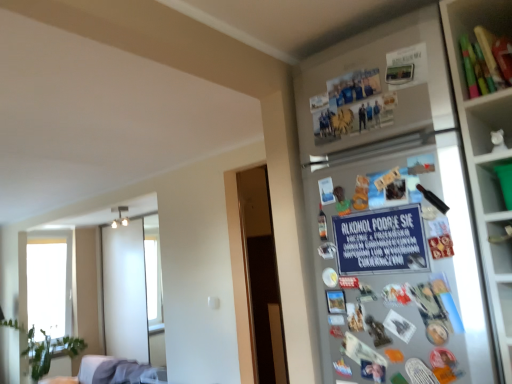
What is the approximate height of transparent glass window at left?

transparent glass window at left is 5.44 feet in height.

Locate an element on the screen. This screenshot has height=384, width=512. transparent glass window at left is located at coordinates (47, 286).

At what (x,y) coordinates should I click in order to perform the action: click on blue paper sign at upper right. Please return your answer as a coordinate pair (x, y). The height and width of the screenshot is (384, 512). Looking at the image, I should click on (380, 241).

What do you see at coordinates (474, 23) in the screenshot? I see `matte plastic utensils at upper right` at bounding box center [474, 23].

What do you see at coordinates (109, 372) in the screenshot?
I see `white fabric couch at lower left` at bounding box center [109, 372].

What is the approximate width of white fabric couch at lower left?

white fabric couch at lower left is 38.43 inches wide.

Image resolution: width=512 pixels, height=384 pixels. In order to click on transparent glass window at left in this screenshot , I will do `click(47, 286)`.

Between silver metallic fridge at upper right and matte plastic utensils at upper right, which one appears on the right side from the viewer's perspective?

matte plastic utensils at upper right is more to the right.

Considering the positions of objects silver metallic fridge at upper right and matte plastic utensils at upper right in the image provided, who is behind, silver metallic fridge at upper right or matte plastic utensils at upper right?

Positioned behind is matte plastic utensils at upper right.

Is silver metallic fridge at upper right completely or partially outside of matte plastic utensils at upper right?

Yes, silver metallic fridge at upper right is located beyond the bounds of matte plastic utensils at upper right.

Who is bigger, silver metallic fridge at upper right or matte plastic utensils at upper right?

silver metallic fridge at upper right is bigger.

Considering the sizes of objects silver metallic fridge at upper right and blue paper sign at upper right in the image provided, who is shorter, silver metallic fridge at upper right or blue paper sign at upper right?

blue paper sign at upper right is shorter.

Can you see silver metallic fridge at upper right touching blue paper sign at upper right?

Yes.

Is silver metallic fridge at upper right oriented towards blue paper sign at upper right?

Yes, silver metallic fridge at upper right is aimed at blue paper sign at upper right.

Which object is closer to the camera taking this photo, white fabric couch at lower left or blue paper sign at upper right?

blue paper sign at upper right is in front.

Is white fabric couch at lower left with blue paper sign at upper right?

There is a gap between white fabric couch at lower left and blue paper sign at upper right.

From the image's perspective, which is above, white fabric couch at lower left or blue paper sign at upper right?

blue paper sign at upper right appears higher in the image.

From a real-world perspective, between white fabric couch at lower left and blue paper sign at upper right, who is vertically higher?

From a 3D spatial view, blue paper sign at upper right is above.

From a real-world perspective, is green plastic container at upper right physically located above or below white fabric couch at lower left?

green plastic container at upper right is above white fabric couch at lower left.

Considering the relative sizes of green plastic container at upper right and white fabric couch at lower left in the image provided, is green plastic container at upper right smaller than white fabric couch at lower left?

Correct, green plastic container at upper right occupies less space than white fabric couch at lower left.

From the image's perspective, is green plastic container at upper right on top of white fabric couch at lower left?

Yes, from the image's perspective, green plastic container at upper right is above white fabric couch at lower left.

Considering the relative positions of green plastic container at upper right and silver metallic fridge at upper right in the image provided, is green plastic container at upper right to the left or to the right of silver metallic fridge at upper right?

From the image, it's evident that green plastic container at upper right is to the right of silver metallic fridge at upper right.

Is point (494, 211) in front of point (361, 239)?

Yes.

Is green plastic container at upper right taller than silver metallic fridge at upper right?

No.

Does point (497, 33) appear closer or farther from the camera than point (84, 379)?

Point (497, 33) is closer to the camera than point (84, 379).

Can you tell me how much matte plastic utensils at upper right and white fabric couch at lower left differ in facing direction?

2.83 degrees.

Which of these two, matte plastic utensils at upper right or white fabric couch at lower left, is thinner?

matte plastic utensils at upper right.

Could you tell me if matte plastic utensils at upper right is facing white fabric couch at lower left?

No, matte plastic utensils at upper right is not facing towards white fabric couch at lower left.

Consider the image. Considering their positions, is blue paper sign at upper right located in front of or behind transparent glass window at left?

blue paper sign at upper right is positioned closer to the viewer than transparent glass window at left.

From a real-world perspective, is blue paper sign at upper right over transparent glass window at left?

Yes, from a real-world perspective, blue paper sign at upper right is over transparent glass window at left

Is blue paper sign at upper right oriented away from transparent glass window at left?

That's not correct — blue paper sign at upper right is not looking away from transparent glass window at left.

Where is `fridge in front of the matte plastic utensils at upper right`? The image size is (512, 384). fridge in front of the matte plastic utensils at upper right is located at coordinates (398, 268).

Where is `writing behind the silver metallic fridge at upper right`? This screenshot has height=384, width=512. writing behind the silver metallic fridge at upper right is located at coordinates (380, 241).

Which object lies nearer to the anchor point transparent glass window at left, green plastic container at upper right or silver metallic fridge at upper right?

The object closer to transparent glass window at left is silver metallic fridge at upper right.

Looking at the image, which one is located further to blue paper sign at upper right, white fabric couch at lower left or matte plastic utensils at upper right?

white fabric couch at lower left is further to blue paper sign at upper right.

When comparing their distances from white fabric couch at lower left, does transparent glass window at left or silver metallic fridge at upper right seem further?

The object further to white fabric couch at lower left is silver metallic fridge at upper right.

Which object lies nearer to the anchor point white fabric couch at lower left, blue paper sign at upper right or matte plastic utensils at upper right?

blue paper sign at upper right.

Considering their positions, is green plastic container at upper right positioned closer to white fabric couch at lower left than silver metallic fridge at upper right?

silver metallic fridge at upper right lies closer to white fabric couch at lower left than the other object.

Based on their spatial positions, is transparent glass window at left or white fabric couch at lower left closer to blue paper sign at upper right?

white fabric couch at lower left is closer to blue paper sign at upper right.

Based on the photo, based on their spatial positions, is transparent glass window at left or silver metallic fridge at upper right closer to blue paper sign at upper right?

Based on the image, silver metallic fridge at upper right appears to be nearer to blue paper sign at upper right.

Considering their positions, is silver metallic fridge at upper right positioned further to matte plastic utensils at upper right than green plastic container at upper right?

The object further to matte plastic utensils at upper right is silver metallic fridge at upper right.

You are a GUI agent. You are given a task and a screenshot of the screen. Output one action in this format:
    pyautogui.click(x=<x>, y=<y>)
    Task: Click on the furniture positioned between blue paper sign at upper right and transparent glass window at left from near to far
    Image resolution: width=512 pixels, height=384 pixels.
    Given the screenshot: What is the action you would take?
    pyautogui.click(x=109, y=372)

I want to click on writing between matte plastic utensils at upper right and silver metallic fridge at upper right in the up-down direction, so click(x=380, y=241).

Find the location of a particular element. This screenshot has height=384, width=512. fridge situated between white fabric couch at lower left and matte plastic utensils at upper right from left to right is located at coordinates (398, 268).

At what (x,y) coordinates should I click in order to perform the action: click on furniture located between silver metallic fridge at upper right and transparent glass window at left in the depth direction. Please return your answer as a coordinate pair (x, y). The image size is (512, 384). Looking at the image, I should click on (109, 372).